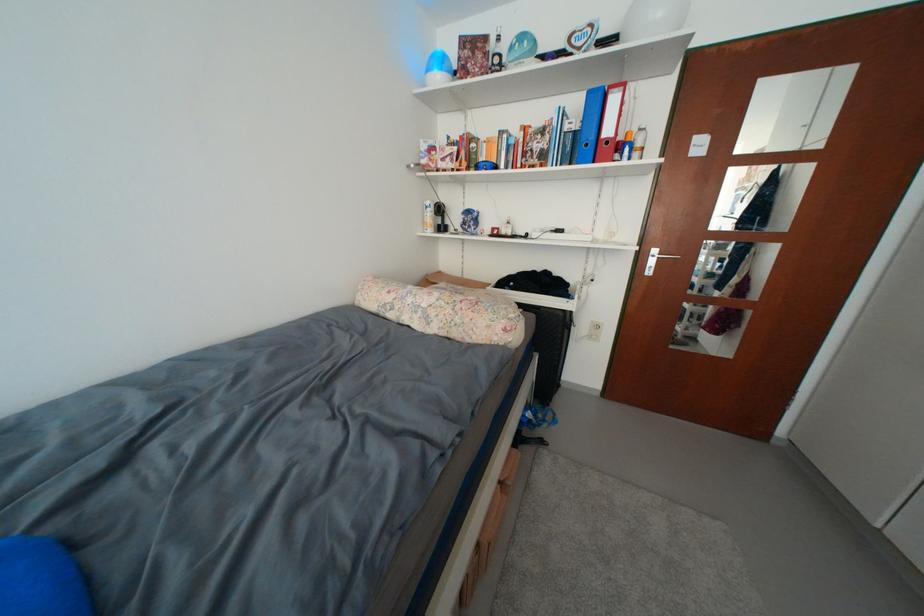
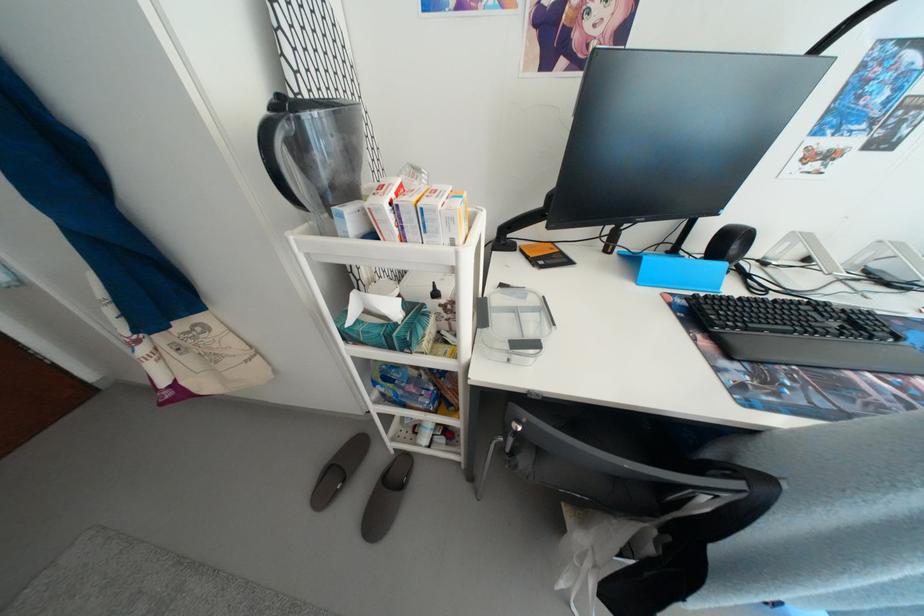
First-person continuous shooting, in which direction is the camera rotating?

The camera's rotation is toward right-down.